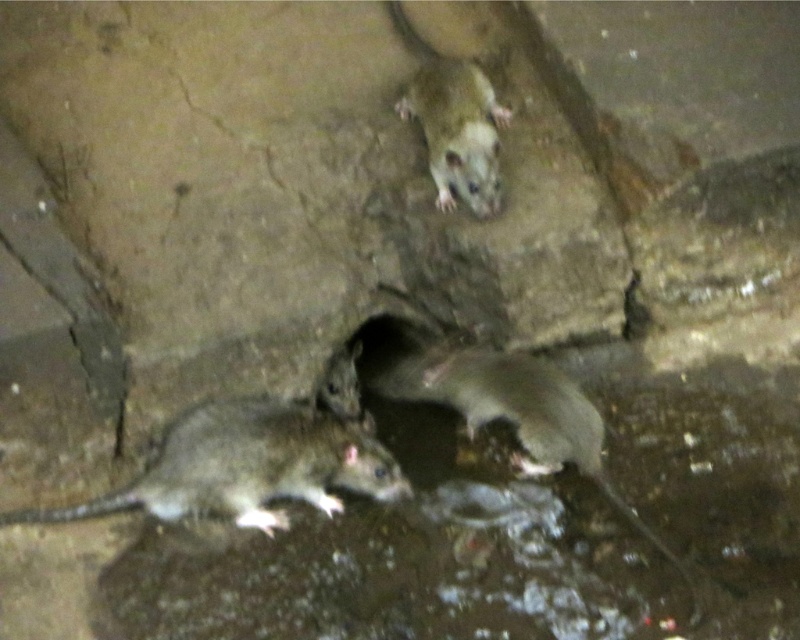
Question: Is gray matte mouse at lower left to the left of gray fur mouse at lower center from the viewer's perspective?

Choices:
 (A) no
 (B) yes

Answer: (B)

Question: Is gray matte mouse at lower left smaller than fuzzy gray mouse at upper center?

Choices:
 (A) yes
 (B) no

Answer: (A)

Question: Can you confirm if gray fur mouse at lower center is bigger than fuzzy gray mouse at upper center?

Choices:
 (A) yes
 (B) no

Answer: (A)

Question: Which object is farther from the camera taking this photo?

Choices:
 (A) gray fur mouse at lower center
 (B) fuzzy gray mouse at upper center

Answer: (B)

Question: Which point is closer to the camera?

Choices:
 (A) fuzzy gray mouse at upper center
 (B) gray fur mouse at lower center
 (C) gray matte mouse at lower left

Answer: (B)

Question: Which point is farther to the camera?

Choices:
 (A) (454, 106)
 (B) (645, 525)
 (C) (244, 509)

Answer: (A)